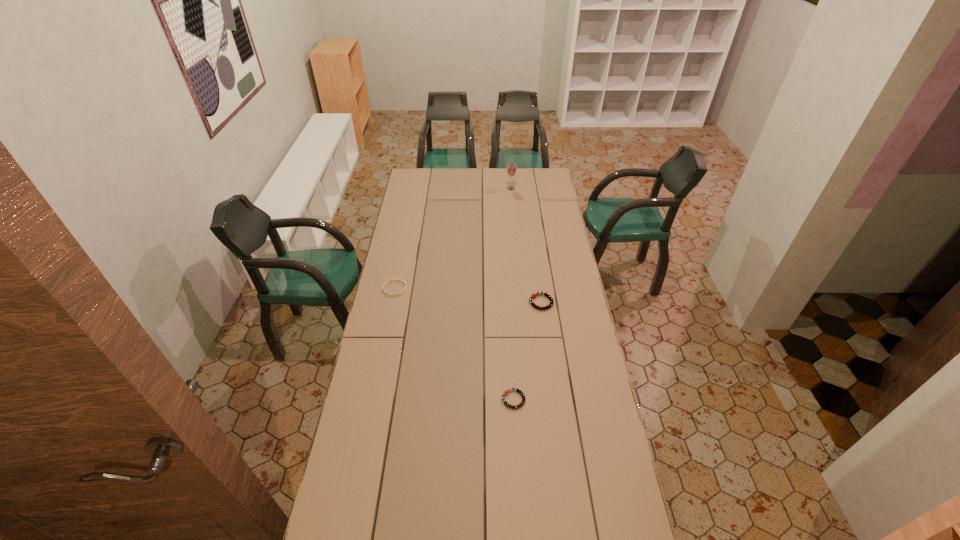
I want to click on the second closest bracelet relative to the rightmost bracelet, so (x=386, y=282).

Where is `vacant position in the image that satisfies the following two spatial constraints: 1. on the surface of the second bracelet from right to left showing star-shaped elements; 2. on the left side of the leftmost object`? vacant position in the image that satisfies the following two spatial constraints: 1. on the surface of the second bracelet from right to left showing star-shaped elements; 2. on the left side of the leftmost object is located at coordinates (372, 400).

Where is `vacant space that satisfies the following two spatial constraints: 1. on the surface of the nearest object showing star-shaped elements; 2. on the right side of the leftmost object`? This screenshot has height=540, width=960. vacant space that satisfies the following two spatial constraints: 1. on the surface of the nearest object showing star-shaped elements; 2. on the right side of the leftmost object is located at coordinates (372, 400).

Locate an element on the screen. The width and height of the screenshot is (960, 540). vacant space that satisfies the following two spatial constraints: 1. on the surface of the second bracelet from left to right showing star-shaped elements; 2. on the left side of the leftmost object is located at coordinates (372, 400).

Image resolution: width=960 pixels, height=540 pixels. I want to click on free point that satisfies the following two spatial constraints: 1. on the surface of the leftmost object showing star-shaped elements; 2. on the right side of the nearest bracelet, so click(x=372, y=400).

The image size is (960, 540). In order to click on vacant region that satisfies the following two spatial constraints: 1. on the surface of the second bracelet from left to right showing star-shaped elements; 2. on the left side of the leftmost bracelet in this screenshot , I will do `click(372, 400)`.

This screenshot has width=960, height=540. In order to click on free spot that satisfies the following two spatial constraints: 1. on the surface of the leftmost object showing star-shaped elements; 2. on the left side of the rightmost bracelet in this screenshot , I will do `click(392, 302)`.